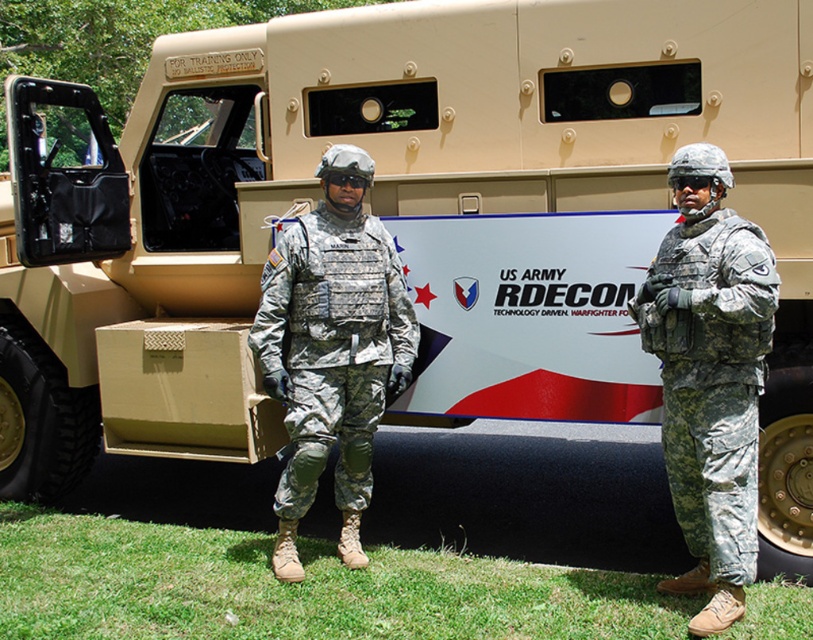
Does camouflage fabric uniform at right have a lesser width compared to camouflage fabric vest at center?

Yes.

Is camouflage fabric uniform at right below camouflage fabric vest at center?

Indeed, camouflage fabric uniform at right is positioned under camouflage fabric vest at center.

Where is `camouflage fabric uniform at right`? The image size is (813, 640). camouflage fabric uniform at right is located at coordinates (711, 376).

The image size is (813, 640). What are the coordinates of `camouflage fabric uniform at right` in the screenshot? It's located at (711, 376).